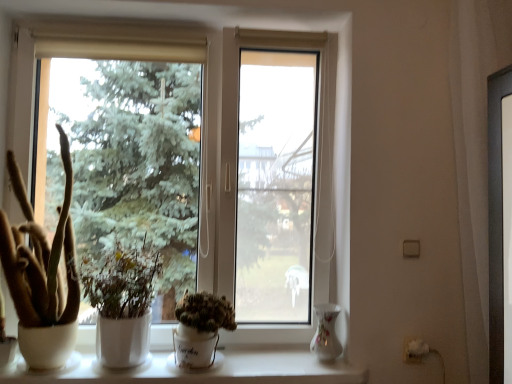
Identify the location of green matte cactus at center, the 3th houseplant viewed from the left. (200, 328).

At what (x,y) coordinates should I click in order to perform the action: click on porcelain floral vase at lower right. Please return your answer as a coordinate pair (x, y). This screenshot has width=512, height=384. Looking at the image, I should click on (326, 333).

I want to click on white matte plant at center, which ranks as the 2th houseplant in right-to-left order, so click(x=121, y=302).

Is green matte cactus at center, which appears as the first houseplant when viewed from the right, at the back of white matte plant at center, which ranks as the 2th houseplant in right-to-left order?

No, green matte cactus at center, which appears as the first houseplant when viewed from the right, is not at the back of white matte plant at center, which ranks as the 2th houseplant in right-to-left order.

Which object is positioned more to the left, white matte plant at center, the 2th houseplant positioned from the left, or green matte cactus at center, which appears as the first houseplant when viewed from the right?

white matte plant at center, the 2th houseplant positioned from the left.

Is the position of white matte plant at center, the 2th houseplant positioned from the left, more distant than that of green matte cactus at center, which appears as the first houseplant when viewed from the right?

No, it is not.

How different are the orientations of white matte plant at center, which ranks as the 2th houseplant in right-to-left order, and green matte cactus at center, which appears as the first houseplant when viewed from the right, in degrees?

The facing directions of white matte plant at center, which ranks as the 2th houseplant in right-to-left order, and green matte cactus at center, which appears as the first houseplant when viewed from the right, are 0.000907 degrees apart.

Which is farther from the camera, (333, 325) or (168, 354)?

The point (168, 354) is more distant.

Is porcelain floral vase at lower right taller than white ceramic at lower center?

Yes, porcelain floral vase at lower right is taller than white ceramic at lower center.

Consider the image. Is porcelain floral vase at lower right touching white ceramic at lower center?

No.

Locate an element on the screen. This screenshot has height=384, width=512. glass vase behind the white ceramic at lower center is located at coordinates pyautogui.click(x=326, y=333).

Between white ceramic at lower center and transparent glass window at center, which one is positioned behind?

transparent glass window at center is behind.

In the scene shown: From the image's perspective, does white ceramic at lower center appear higher than transparent glass window at center?

Incorrect, from the image's perspective, white ceramic at lower center is lower than transparent glass window at center.

Between white ceramic at lower center and transparent glass window at center, which one has smaller width?

transparent glass window at center.

Does white matte plant at center, the 2th houseplant positioned from the left, turn towards white ceramic at lower center?

No, white matte plant at center, the 2th houseplant positioned from the left, does not turn towards white ceramic at lower center.

Is white matte plant at center, the 2th houseplant positioned from the left, not near white ceramic at lower center?

They are positioned close to each other.

Is white matte plant at center, which ranks as the 2th houseplant in right-to-left order, completely or partially outside of white ceramic at lower center?

Yes, white matte plant at center, which ranks as the 2th houseplant in right-to-left order, is located beyond the bounds of white ceramic at lower center.

Is point (135, 321) less distant than point (71, 359)?

That is True.

Which is more to the right, green matte cactus at center, which appears as the first houseplant when viewed from the right, or transparent glass window at center?

From the viewer's perspective, green matte cactus at center, which appears as the first houseplant when viewed from the right, appears more on the right side.

Looking at this image, is green matte cactus at center, which appears as the first houseplant when viewed from the right, not near transparent glass window at center?

No, green matte cactus at center, which appears as the first houseplant when viewed from the right, is in close proximity to transparent glass window at center.

Considering the relative sizes of green matte cactus at center, the 3th houseplant viewed from the left, and transparent glass window at center in the image provided, is green matte cactus at center, the 3th houseplant viewed from the left, wider than transparent glass window at center?

No, green matte cactus at center, the 3th houseplant viewed from the left, is not wider than transparent glass window at center.

Is green matte cactus at center, which appears as the first houseplant when viewed from the right, not inside transparent glass window at center?

No.

Considering the points (24, 80) and (187, 296), which point is behind, point (24, 80) or point (187, 296)?

The point (24, 80) is more distant.

Between transparent glass window at center and green matte cactus at center, the 3th houseplant viewed from the left, which one appears on the right side from the viewer's perspective?

From the viewer's perspective, green matte cactus at center, the 3th houseplant viewed from the left, appears more on the right side.

From the image's perspective, is transparent glass window at center above or below green matte cactus at center, the 3th houseplant viewed from the left?

From the image's perspective, transparent glass window at center appears above green matte cactus at center, the 3th houseplant viewed from the left.

Is transparent glass window at center positioned far away from green matte cactus at center, which appears as the first houseplant when viewed from the right?

They are positioned close to each other.

Is porcelain floral vase at lower right shorter than brown fuzzy cactus at left, the 1th houseplant in the left-to-right sequence?

Yes.

Choose the correct answer: Is porcelain floral vase at lower right inside brown fuzzy cactus at left, the 1th houseplant in the left-to-right sequence, or outside it?

porcelain floral vase at lower right cannot be found inside brown fuzzy cactus at left, the 1th houseplant in the left-to-right sequence.

Are porcelain floral vase at lower right and brown fuzzy cactus at left, acting as the 3th houseplant starting from the right, making contact?

No, porcelain floral vase at lower right is not next to brown fuzzy cactus at left, acting as the 3th houseplant starting from the right.

Looking at this image, considering the relative positions of porcelain floral vase at lower right and brown fuzzy cactus at left, the 1th houseplant in the left-to-right sequence, in the image provided, is porcelain floral vase at lower right to the left of brown fuzzy cactus at left, the 1th houseplant in the left-to-right sequence, from the viewer's perspective?

No.

I want to click on houseplant that appears on the right of white matte plant at center, the 2th houseplant positioned from the left, so click(200, 328).

This screenshot has height=384, width=512. I want to click on window sill located underneath the porcelain floral vase at lower right (from a real-world perspective), so click(199, 370).

Considering their positions, is white ceramic at lower center positioned further to porcelain floral vase at lower right than green matte cactus at center, which appears as the first houseplant when viewed from the right?

green matte cactus at center, which appears as the first houseplant when viewed from the right.

Estimate the real-world distances between objects in this image. Which object is closer to white ceramic at lower center, porcelain floral vase at lower right or brown fuzzy cactus at left, acting as the 3th houseplant starting from the right?

The object closer to white ceramic at lower center is porcelain floral vase at lower right.

From the picture: Based on their spatial positions, is white ceramic at lower center or white matte plant at center, which ranks as the 2th houseplant in right-to-left order, further from brown fuzzy cactus at left, the 1th houseplant in the left-to-right sequence?

white ceramic at lower center lies further to brown fuzzy cactus at left, the 1th houseplant in the left-to-right sequence, than the other object.

Estimate the real-world distances between objects in this image. Which object is closer to white matte plant at center, which ranks as the 2th houseplant in right-to-left order, porcelain floral vase at lower right or green matte cactus at center, the 3th houseplant viewed from the left?

green matte cactus at center, the 3th houseplant viewed from the left, is closer to white matte plant at center, which ranks as the 2th houseplant in right-to-left order.

When comparing their distances from transparent glass window at center, does porcelain floral vase at lower right or green matte cactus at center, which appears as the first houseplant when viewed from the right, seem closer?

green matte cactus at center, which appears as the first houseplant when viewed from the right, is positioned closer to the anchor transparent glass window at center.

Based on their spatial positions, is white matte plant at center, the 2th houseplant positioned from the left, or white ceramic at lower center further from brown fuzzy cactus at left, the 1th houseplant in the left-to-right sequence?

A: white ceramic at lower center is further to brown fuzzy cactus at left, the 1th houseplant in the left-to-right sequence.

Based on their spatial positions, is brown fuzzy cactus at left, the 1th houseplant in the left-to-right sequence, or green matte cactus at center, the 3th houseplant viewed from the left, further from porcelain floral vase at lower right?

brown fuzzy cactus at left, the 1th houseplant in the left-to-right sequence, lies further to porcelain floral vase at lower right than the other object.

Based on their spatial positions, is white matte plant at center, which ranks as the 2th houseplant in right-to-left order, or transparent glass window at center closer to porcelain floral vase at lower right?

Based on the image, transparent glass window at center appears to be nearer to porcelain floral vase at lower right.

Locate an element on the screen. window between brown fuzzy cactus at left, the 1th houseplant in the left-to-right sequence, and green matte cactus at center, the 3th houseplant viewed from the left is located at coordinates (217, 131).

Find the location of a particular element. window situated between brown fuzzy cactus at left, the 1th houseplant in the left-to-right sequence, and porcelain floral vase at lower right from left to right is located at coordinates (217, 131).

Locate an element on the screen. The width and height of the screenshot is (512, 384). glass vase between transparent glass window at center and white ceramic at lower center in the vertical direction is located at coordinates (326, 333).

The image size is (512, 384). In order to click on window sill located between brown fuzzy cactus at left, the 1th houseplant in the left-to-right sequence, and porcelain floral vase at lower right in the left-right direction in this screenshot , I will do `click(199, 370)`.